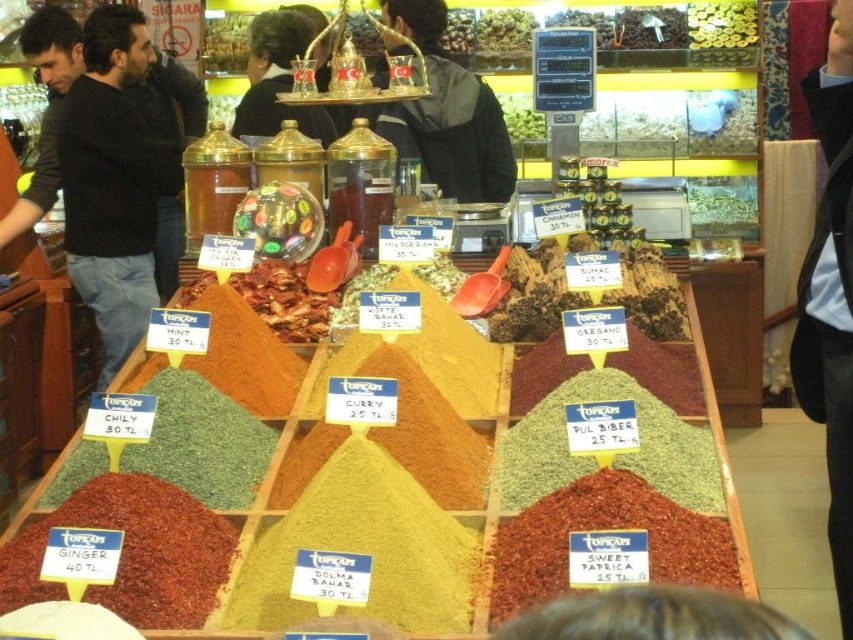
You are a customer at the spice market stall. You want to purchase the yellow powder curry at center but accidentally knocked over the green leafy vegetable at center. Which item is more likely to spill and make a mess?

The yellow powder curry at center is more likely to spill and make a mess because it is in front of the green leafy vegetable at center, meaning it is closer to the edge of the display case and might fall over first.

You are a customer at the spice market stall. You see the bright red paprika at center and the green leafy vegetable at center. Which one is positioned lower in the display?

The bright red paprika at center is located below the green leafy vegetable at center, so it is positioned lower in the display.